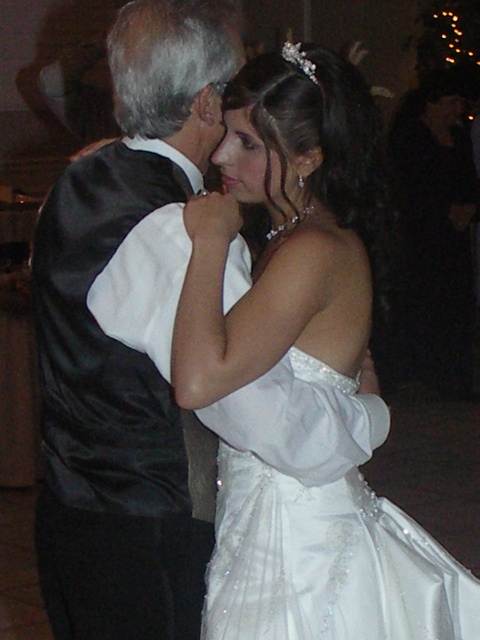
You are standing at the point with coordinates point (116, 512) and want to walk to the point with coordinates point (432, 637). Is there a clear path between these two points without any obstacles?

Point (116, 512) is behind point (432, 637), so there might be an obstacle blocking the path between them. You may need to find an alternative route around point (432, 637) to reach your destination.

Based on the scene description, where is the satin black vest at left located in terms of its 2D coordinates?

The satin black vest at left is located at the 2D coordinates of point [123,344].